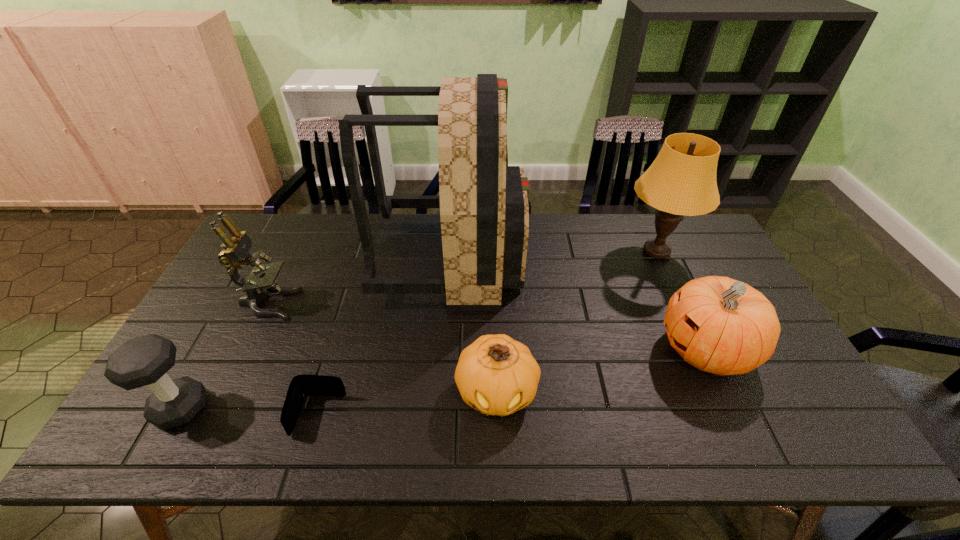
Locate an element on the screen. Image resolution: width=960 pixels, height=540 pixels. free space between the shorter pumpkin and the lampshade is located at coordinates (577, 321).

This screenshot has height=540, width=960. Identify the location of vacant area that lies between the backpack and the wallet. (385, 338).

Find the location of a particular element. Image resolution: width=960 pixels, height=540 pixels. free space between the dumbbell and the third tallest object is located at coordinates tap(225, 356).

At what (x,y) coordinates should I click in order to perform the action: click on free space between the second tallest object and the backpack. Please return your answer as a coordinate pair (x, y). Looking at the image, I should click on (554, 255).

Where is `free space between the fifth shortest object and the dumbbell`? Image resolution: width=960 pixels, height=540 pixels. free space between the fifth shortest object and the dumbbell is located at coordinates (225, 356).

Where is `vacant region between the dumbbell and the third tallest object`? The image size is (960, 540). vacant region between the dumbbell and the third tallest object is located at coordinates (225, 356).

At what (x,y) coordinates should I click in order to perform the action: click on free area in between the third tallest object and the backpack. Please return your answer as a coordinate pair (x, y). This screenshot has width=960, height=540. Looking at the image, I should click on (360, 282).

Select which object is the sixth closest to the wallet. Please provide its 2D coordinates. Your answer should be formatted as a tuple, i.e. [(x, y)], where the tuple contains the x and y coordinates of a point satisfying the conditions above.

[(681, 181)]

Locate which object ranks fifth in proximity to the backpack. Please provide its 2D coordinates. Your answer should be formatted as a tuple, i.e. [(x, y)], where the tuple contains the x and y coordinates of a point satisfying the conditions above.

[(719, 325)]

Image resolution: width=960 pixels, height=540 pixels. Find the location of `vacant space that satisfies the following two spatial constraints: 1. on the front-facing side of the right pumpkin; 2. on the front face of the left pumpkin`. vacant space that satisfies the following two spatial constraints: 1. on the front-facing side of the right pumpkin; 2. on the front face of the left pumpkin is located at coordinates coord(726,392).